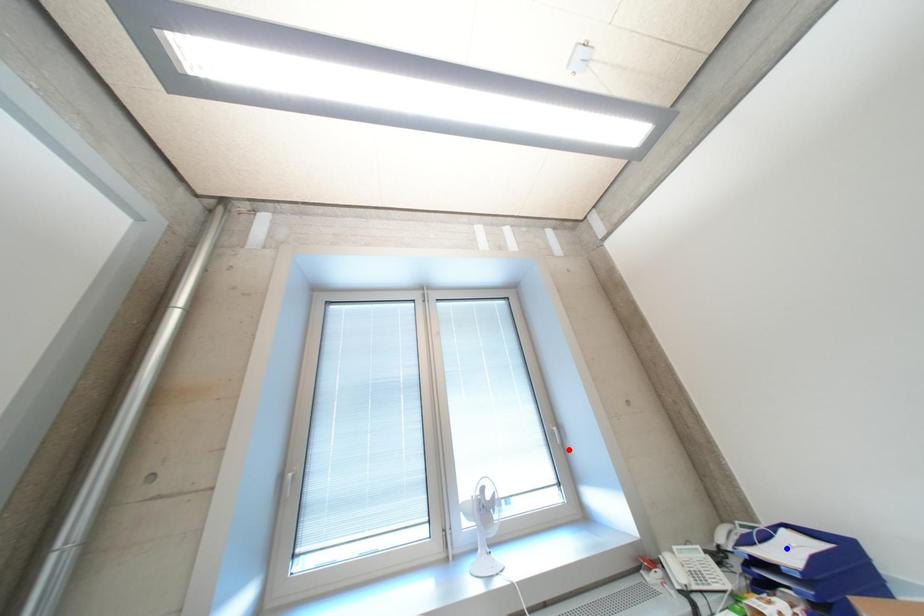
Question: Which of the two points in the image is closer to the camera?

Choices:
 (A) Blue point is closer.
 (B) Red point is closer.

Answer: (A)